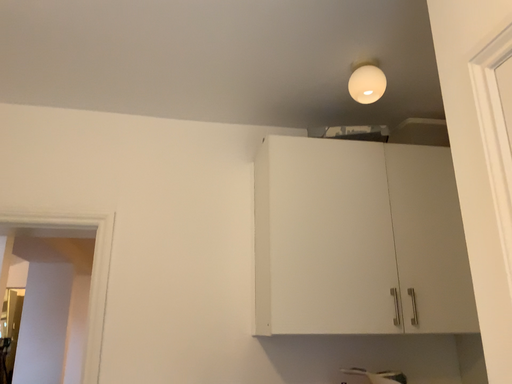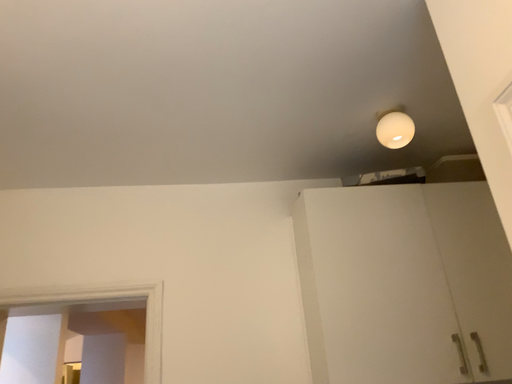
Question: How did the camera likely rotate when shooting the video?

Choices:
 (A) rotated downward
 (B) rotated upward

Answer: (B)